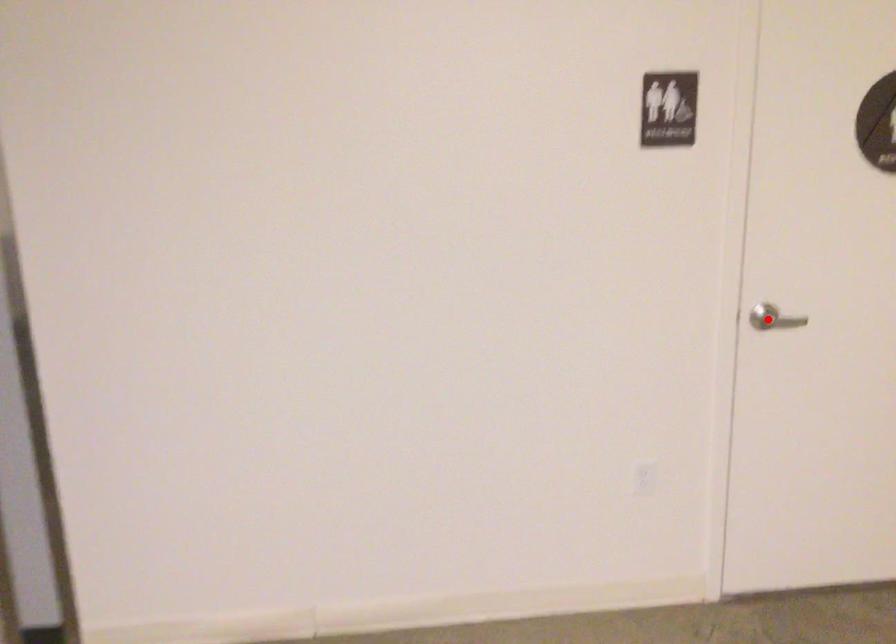
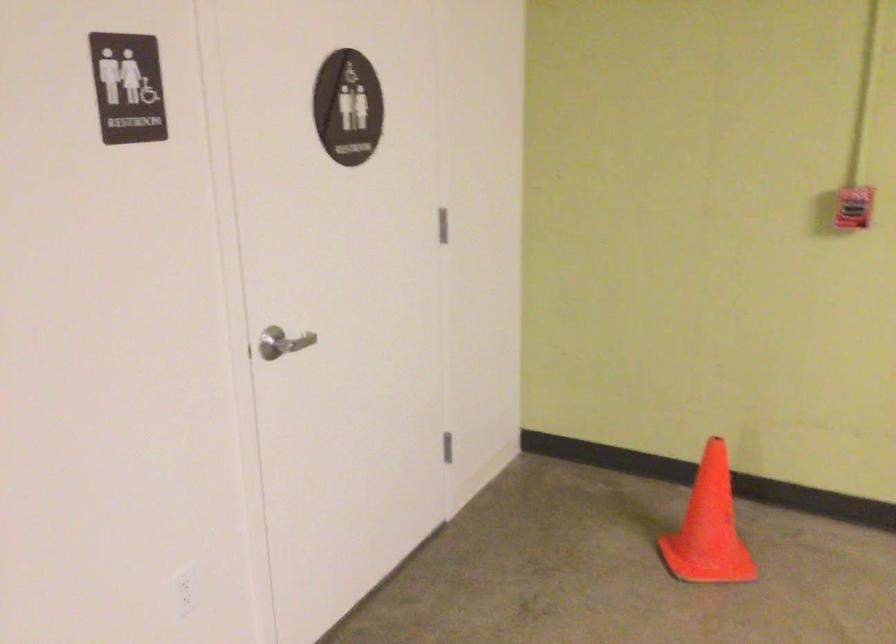
The point at the highlighted location is marked in the first image. Where is the corresponding point in the second image?

(281, 343)